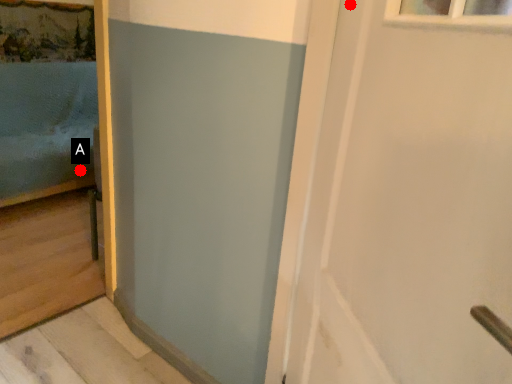
Question: Two points are circled on the image, labeled by A and B beside each circle. Which point is closer to the camera?

Choices:
 (A) A is closer
 (B) B is closer

Answer: (B)